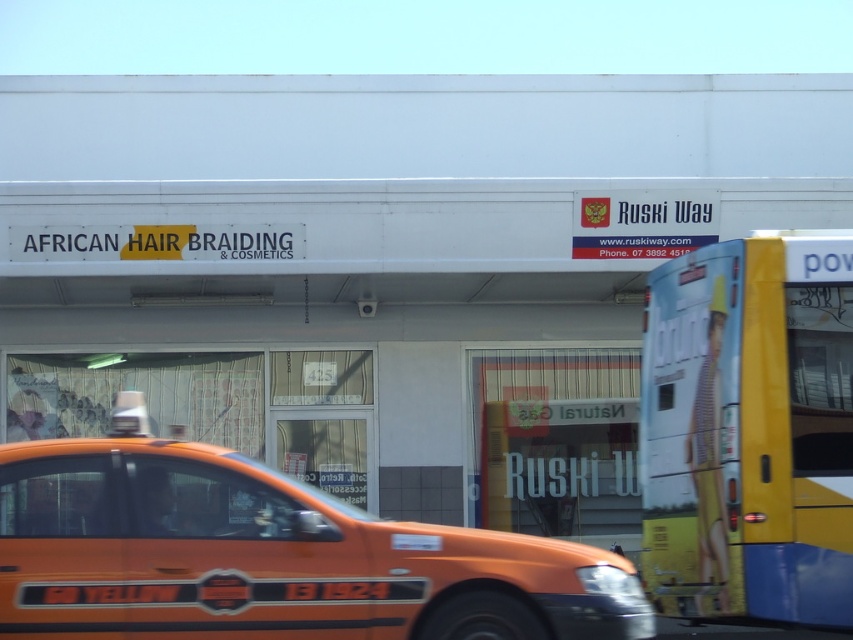
Question: Which point appears farthest from the camera in this image?

Choices:
 (A) (492, 573)
 (B) (668, 509)

Answer: (B)

Question: Is orange matte taxi at center positioned at the back of yellow matte bus at right?

Choices:
 (A) no
 (B) yes

Answer: (A)

Question: Does orange matte taxi at center appear under yellow matte bus at right?

Choices:
 (A) yes
 (B) no

Answer: (A)

Question: Does orange matte taxi at center have a greater width compared to yellow matte bus at right?

Choices:
 (A) no
 (B) yes

Answer: (B)